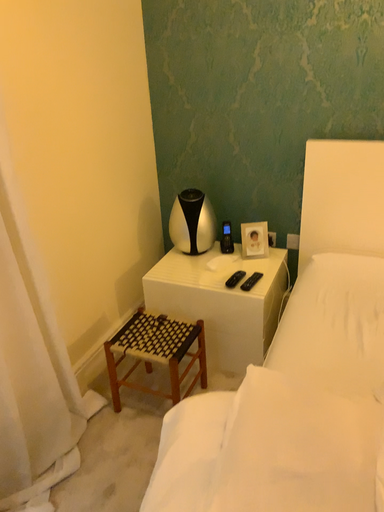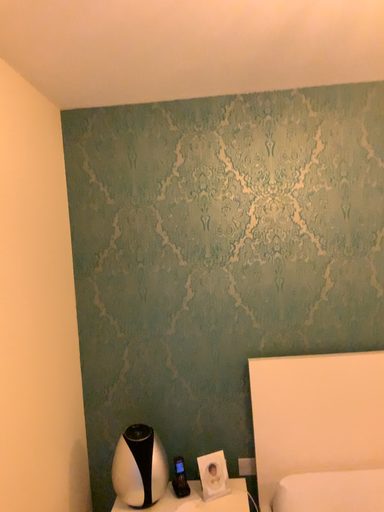
Question: Which way did the camera rotate in the video?

Choices:
 (A) rotated left
 (B) rotated right

Answer: (B)